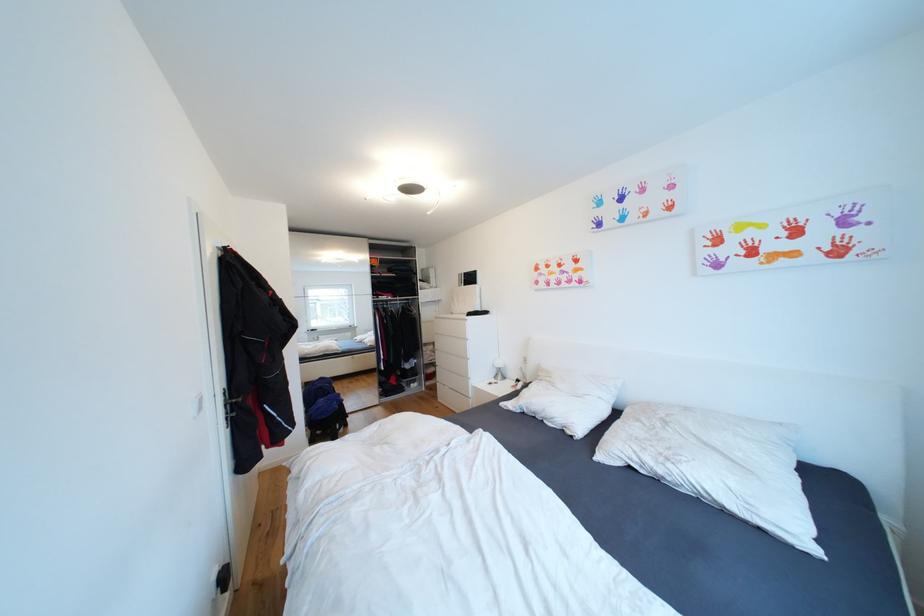
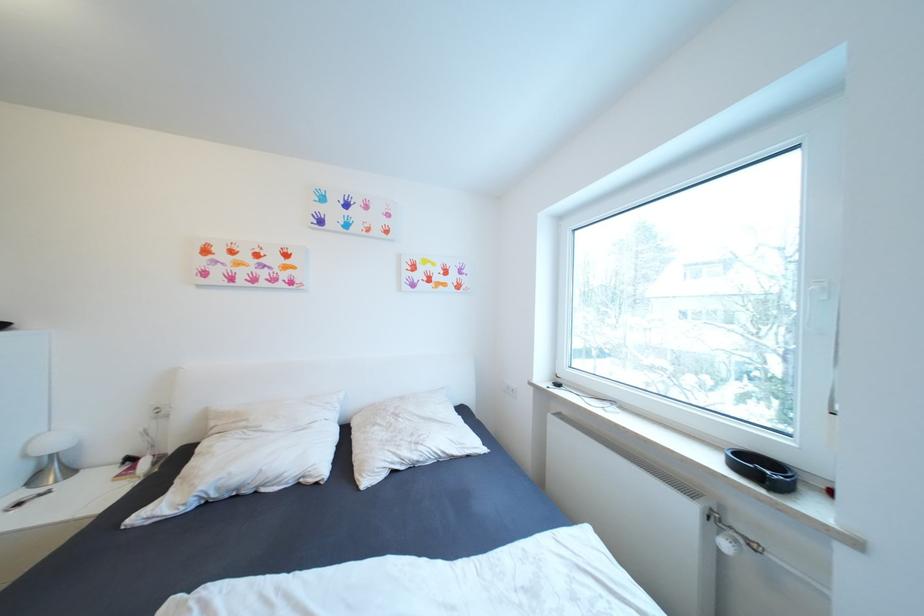
Locate, in the second image, the point that corresponds to point 673,424 in the first image.

(405, 416)